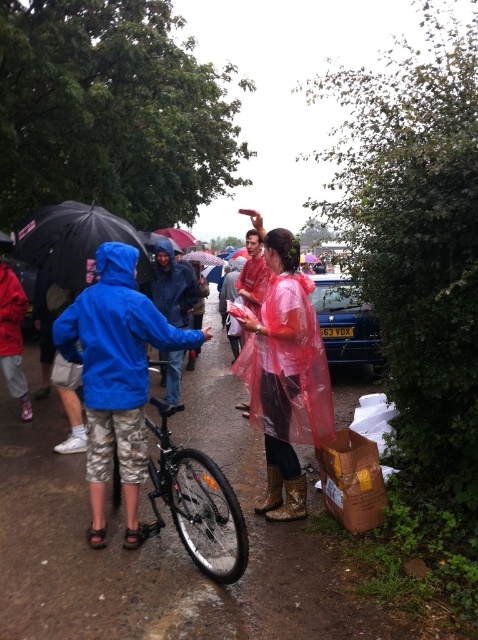
Is black matte umbrella at left taller than transparent plastic umbrella at center?

Incorrect, black matte umbrella at left's height is not larger of transparent plastic umbrella at center's.

Does black matte umbrella at left appear on the left side of transparent plastic umbrella at center?

Incorrect, black matte umbrella at left is not on the left side of transparent plastic umbrella at center.

I want to click on black matte umbrella at left, so click(74, 241).

Does transparent plastic raincoat at center have a larger size compared to transparent plastic umbrella at center?

Actually, transparent plastic raincoat at center might be smaller than transparent plastic umbrella at center.

Which is more to the left, transparent plastic raincoat at center or transparent plastic umbrella at center?

transparent plastic umbrella at center is more to the left.

Between point (276, 248) and point (184, 241), which one is positioned behind?

The point (184, 241) is more distant.

What are the coordinates of `transparent plastic raincoat at center` in the screenshot? It's located at (285, 376).

Can you confirm if blue matte jacket at center is wider than black matte umbrella at left?

Incorrect, blue matte jacket at center's width does not surpass black matte umbrella at left's.

Does point (149, 310) come farther from viewer compared to point (102, 224)?

No, (149, 310) is in front of (102, 224).

What do you see at coordinates (117, 378) in the screenshot? The height and width of the screenshot is (640, 478). I see `blue matte jacket at center` at bounding box center [117, 378].

The image size is (478, 640). Find the location of `blue matte jacket at center`. blue matte jacket at center is located at coordinates (117, 378).